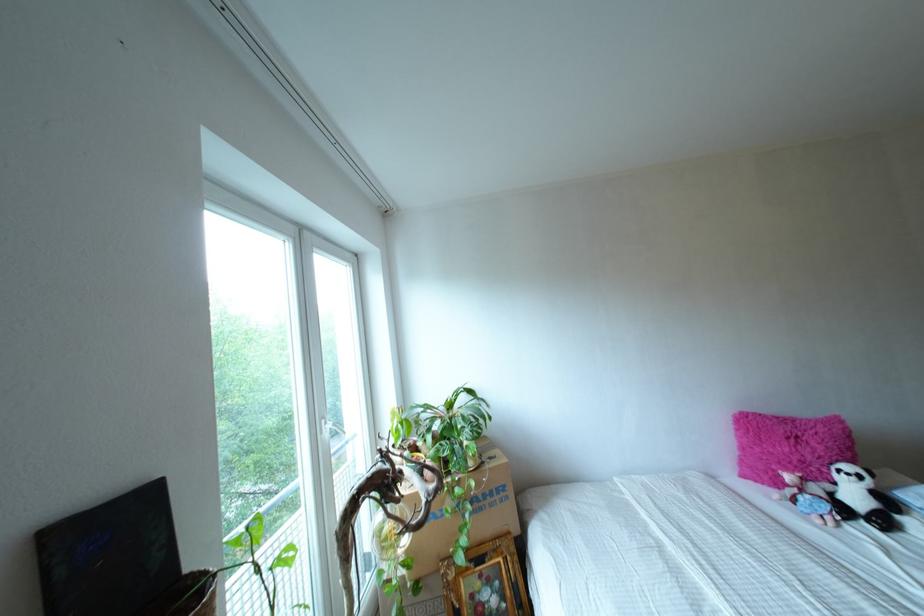
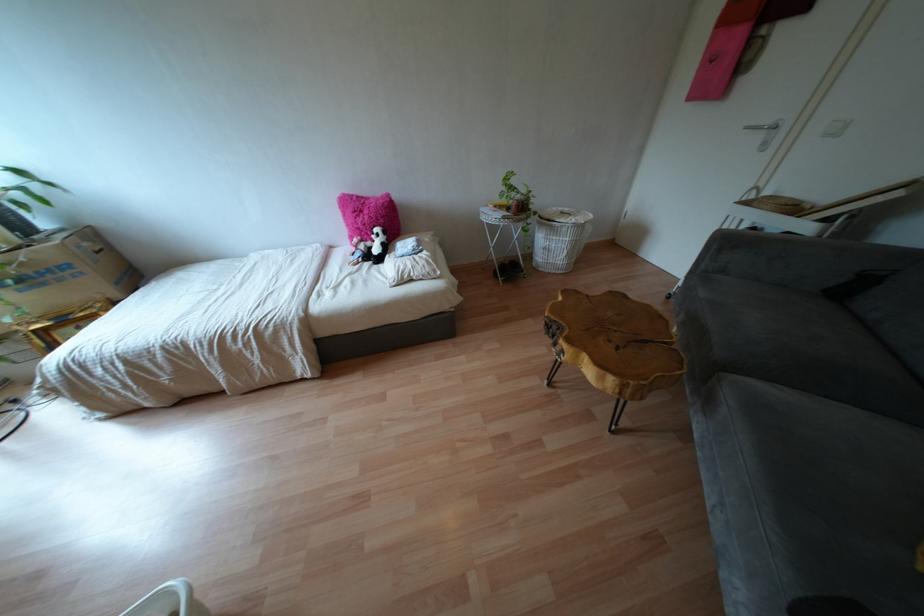
The point at (888, 501) is marked in the first image. Where is the corresponding point in the second image?

(385, 248)